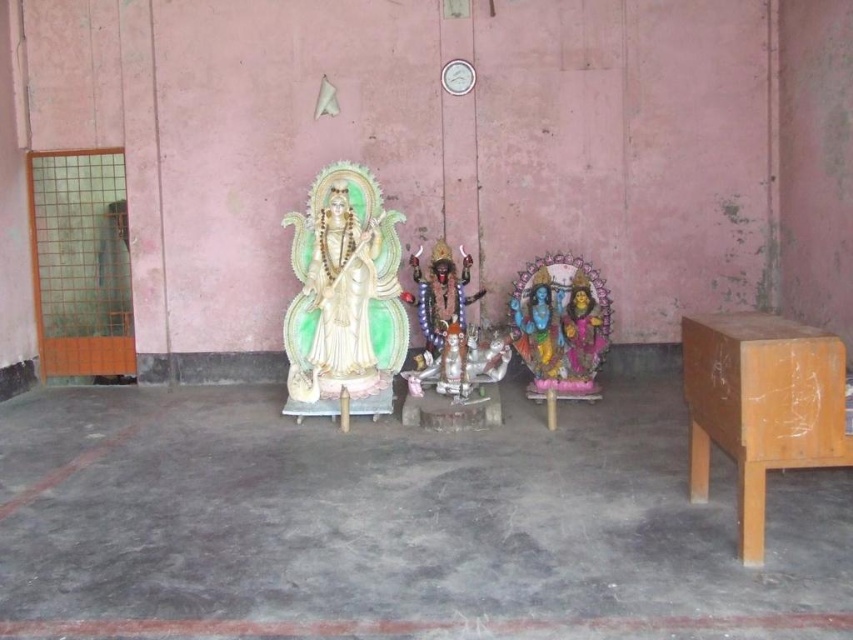
Question: From the image, what is the correct spatial relationship of wooden table at right in relation to ivory glossy statue at center?

Choices:
 (A) below
 (B) above

Answer: (A)

Question: Considering the relative positions of wooden table at right and ivory glossy statue at center in the image provided, where is wooden table at right located with respect to ivory glossy statue at center?

Choices:
 (A) above
 (B) below

Answer: (B)

Question: Among these points, which one is nearest to the camera?

Choices:
 (A) (752, 515)
 (B) (361, 390)

Answer: (A)

Question: Which object is closer to the camera taking this photo?

Choices:
 (A) wooden table at right
 (B) ivory glossy statue at center

Answer: (A)

Question: Does wooden table at right appear under ivory glossy statue at center?

Choices:
 (A) no
 (B) yes

Answer: (B)